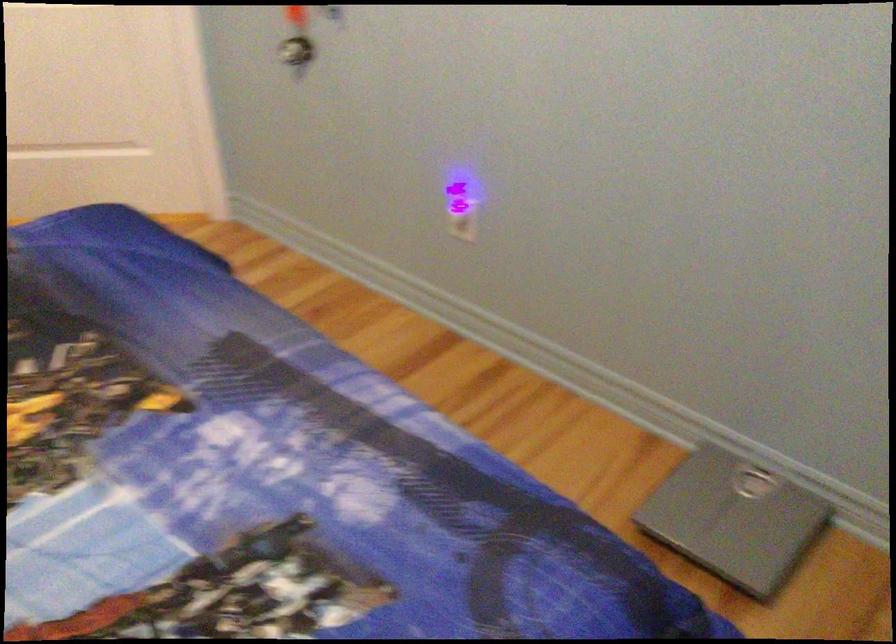
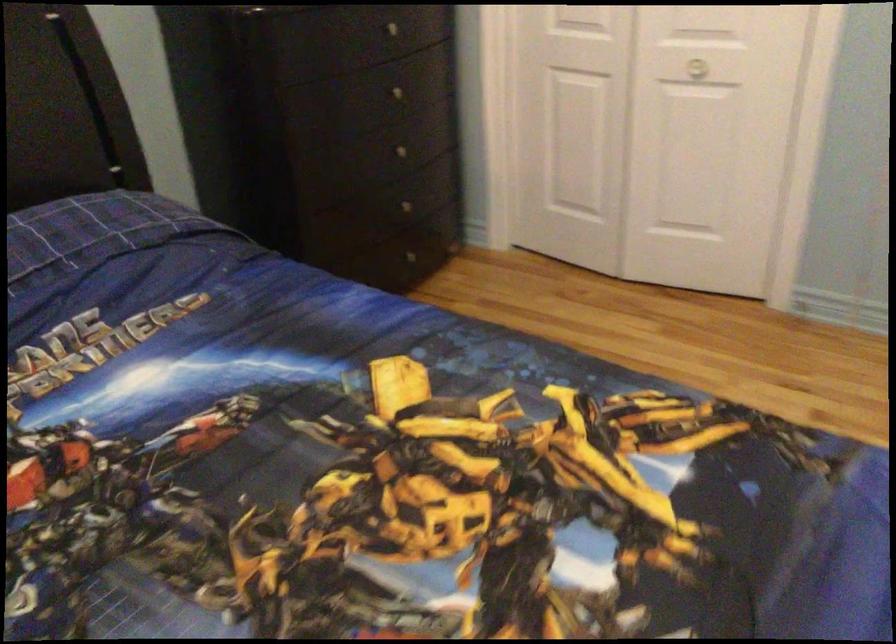
First-person continuous shooting, in which direction is the camera rotating?

The rotation direction of the camera is left-down.